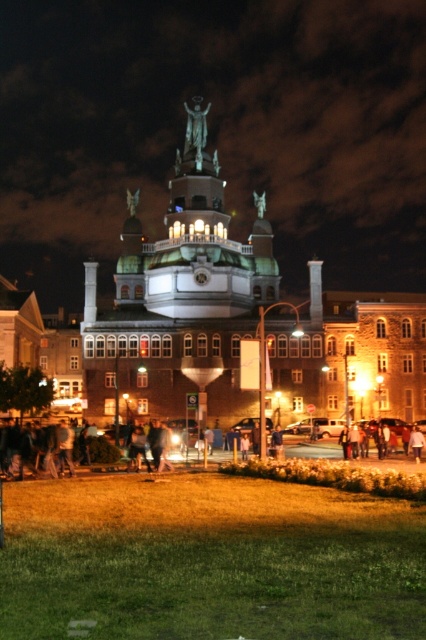
How distant is dark clothing at lower center from polished bronze statue at center?

dark clothing at lower center and polished bronze statue at center are 47.53 meters apart.

Does dark clothing at lower center come behind polished bronze statue at center?

No, dark clothing at lower center is closer to the viewer.

The width and height of the screenshot is (426, 640). Identify the location of dark clothing at lower center. (322, 468).